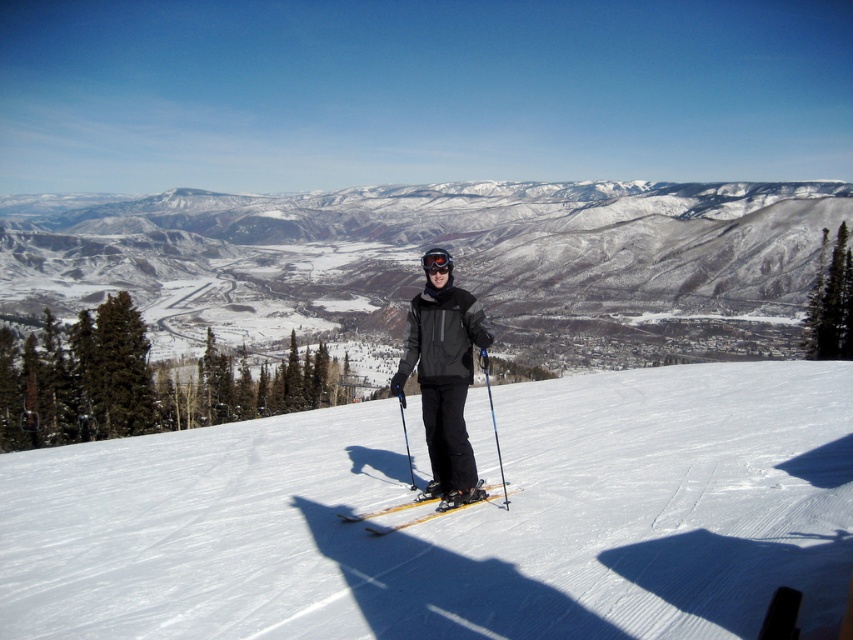
You are a photographer planning to take a photo of the snowy mountain at center and the black matte goggles at center. Based on the scene, which object is closer to the camera?

The snowy mountain at center is closer to the camera than the black matte goggles at center because the goggles are positioned behind the mountain.

You are a photographer planning to take a picture of the snowy mountain at center and the yellow matte skis at center. Based on their sizes in the image, which object would appear larger in the photo?

The snowy mountain at center appears larger in the photo because it has a greater height compared to the yellow matte skis at center.

You are a photographer standing at the base of the snowy mountain at center. You want to take a photo of the mountain from a distance of exactly 100 meters. Can you move closer or farther away to achieve this?

The snowy mountain at center is currently 105.14 meters away. To get to exactly 100 meters, you need to move 5.14 meters closer to the mountain.